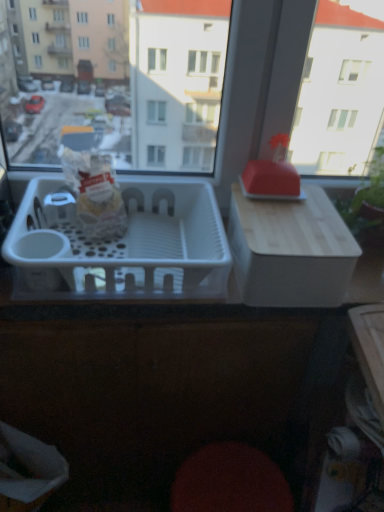
Question: Is green leafy plant at upper right at the left side of matte white bag at center?

Choices:
 (A) yes
 (B) no

Answer: (B)

Question: Is green leafy plant at upper right next to matte white bag at center?

Choices:
 (A) yes
 (B) no

Answer: (B)

Question: Does green leafy plant at upper right have a smaller size compared to matte white bag at center?

Choices:
 (A) no
 (B) yes

Answer: (A)

Question: Can you confirm if green leafy plant at upper right is thinner than matte white bag at center?

Choices:
 (A) no
 (B) yes

Answer: (B)

Question: Would you consider green leafy plant at upper right to be distant from matte white bag at center?

Choices:
 (A) yes
 (B) no

Answer: (B)

Question: Is green leafy plant at upper right bigger or smaller than white plastic basket at center?

Choices:
 (A) small
 (B) big

Answer: (A)

Question: Would you say green leafy plant at upper right is to the left or to the right of white plastic basket at center in the picture?

Choices:
 (A) left
 (B) right

Answer: (B)

Question: Is green leafy plant at upper right taller or shorter than white plastic basket at center?

Choices:
 (A) short
 (B) tall

Answer: (B)

Question: From a real-world perspective, is green leafy plant at upper right positioned above or below white plastic basket at center?

Choices:
 (A) below
 (B) above

Answer: (B)

Question: Is white plastic container at right in front of or behind matte white bag at center in the image?

Choices:
 (A) front
 (B) behind

Answer: (A)

Question: Visually, is white plastic container at right positioned to the left or to the right of matte white bag at center?

Choices:
 (A) right
 (B) left

Answer: (A)

Question: Is point (357, 248) closer or farther from the camera than point (91, 170)?

Choices:
 (A) farther
 (B) closer

Answer: (B)

Question: Which is correct: white plastic container at right is inside matte white bag at center, or outside of it?

Choices:
 (A) inside
 (B) outside

Answer: (B)

Question: From a real-world perspective, is green leafy plant at upper right above or below matte white bag at center?

Choices:
 (A) above
 (B) below

Answer: (B)

Question: Is green leafy plant at upper right inside the boundaries of matte white bag at center, or outside?

Choices:
 (A) outside
 (B) inside

Answer: (A)